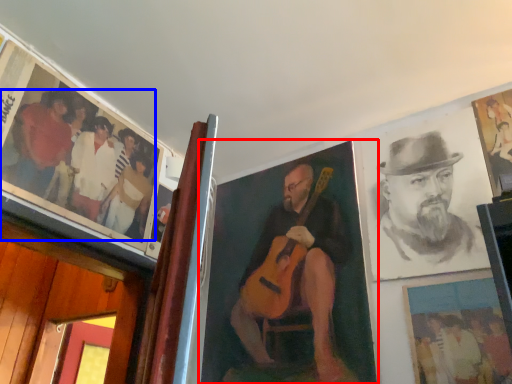
Question: Which object is closer to the camera taking this photo, picture frame (highlighted by a red box) or person (highlighted by a blue box)?

Choices:
 (A) picture frame
 (B) person

Answer: (B)